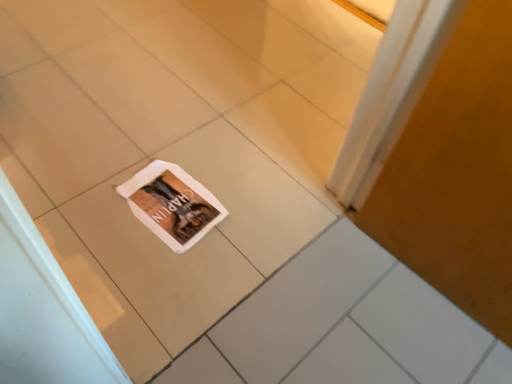
Find the location of a particular element. The image size is (512, 384). vacant space in front of white paper postcard at center is located at coordinates (150, 273).